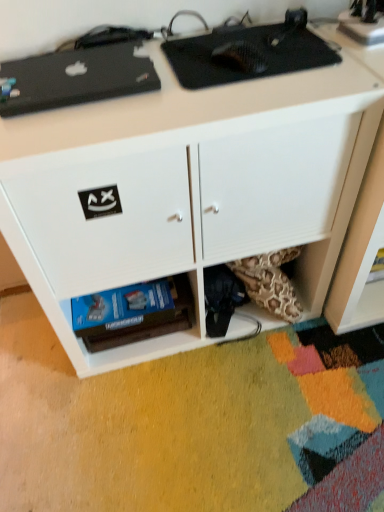
Image resolution: width=384 pixels, height=512 pixels. What do you see at coordinates (248, 53) in the screenshot? I see `black carbon fiber mouse pad at upper center, arranged as the second appliance when viewed from the left` at bounding box center [248, 53].

Describe the element at coordinates (189, 186) in the screenshot. The height and width of the screenshot is (512, 384). I see `white matte desk at upper center` at that location.

Find the location of `metallic silver speaker at upper right, the 3th appliance from the left`. metallic silver speaker at upper right, the 3th appliance from the left is located at coordinates (363, 23).

The height and width of the screenshot is (512, 384). In order to click on black carbon fiber mouse pad at upper center, arranged as the second appliance when viewed from the left in this screenshot , I will do `click(248, 53)`.

From the image's perspective, which is below, white matte desk at upper center or black carbon fiber mouse pad at upper center, arranged as the second appliance when viewed from the left?

white matte desk at upper center.

Would you say white matte desk at upper center is inside or outside black carbon fiber mouse pad at upper center, the second appliance in the right-to-left sequence?

white matte desk at upper center is not enclosed by black carbon fiber mouse pad at upper center, the second appliance in the right-to-left sequence.

Which object is thinner, white matte desk at upper center or black carbon fiber mouse pad at upper center, arranged as the second appliance when viewed from the left?

black carbon fiber mouse pad at upper center, arranged as the second appliance when viewed from the left, is thinner.

Who is taller, white matte desk at upper center or black carbon fiber mouse pad at upper center, arranged as the second appliance when viewed from the left?

white matte desk at upper center.

Which object is thinner, metallic silver speaker at upper right, the 3th appliance from the left, or black carbon fiber mouse pad at upper center, the second appliance in the right-to-left sequence?

Thinner between the two is metallic silver speaker at upper right, the 3th appliance from the left.

From a real-world perspective, relative to black carbon fiber mouse pad at upper center, the second appliance in the right-to-left sequence, is metallic silver speaker at upper right, the 3th appliance from the left, vertically above or below?

From a real-world perspective, metallic silver speaker at upper right, the 3th appliance from the left, is physically above black carbon fiber mouse pad at upper center, the second appliance in the right-to-left sequence.

Is metallic silver speaker at upper right, placed as the first appliance when sorted from right to left, in contact with black carbon fiber mouse pad at upper center, arranged as the second appliance when viewed from the left?

No, metallic silver speaker at upper right, placed as the first appliance when sorted from right to left, is not making contact with black carbon fiber mouse pad at upper center, arranged as the second appliance when viewed from the left.

Is point (366, 16) closer to viewer compared to point (282, 48)?

Yes.

Considering the positions of point (222, 33) and point (78, 58), is point (222, 33) closer or farther from the camera than point (78, 58)?

Point (222, 33).

Considering their positions, is black carbon fiber mouse pad at upper center, arranged as the second appliance when viewed from the left, located in front of or behind black matte laptop at upper left, the third appliance positioned from the right?

Visually, black carbon fiber mouse pad at upper center, arranged as the second appliance when viewed from the left, is located behind black matte laptop at upper left, the third appliance positioned from the right.

Is black carbon fiber mouse pad at upper center, arranged as the second appliance when viewed from the left, aimed at black matte laptop at upper left, the third appliance positioned from the right?

No.

In the image, is black carbon fiber mouse pad at upper center, the second appliance in the right-to-left sequence, on the left side or the right side of black matte laptop at upper left, the third appliance positioned from the right?

From the image, it's evident that black carbon fiber mouse pad at upper center, the second appliance in the right-to-left sequence, is to the right of black matte laptop at upper left, the third appliance positioned from the right.

In the scene shown: From the image's perspective, which one is positioned higher, metallic silver speaker at upper right, the 3th appliance from the left, or white matte desk at upper center?

metallic silver speaker at upper right, the 3th appliance from the left.

Can you confirm if metallic silver speaker at upper right, placed as the first appliance when sorted from right to left, is positioned to the right of white matte desk at upper center?

Yes.

In the scene shown: How much distance is there between metallic silver speaker at upper right, placed as the first appliance when sorted from right to left, and white matte desk at upper center?

metallic silver speaker at upper right, placed as the first appliance when sorted from right to left, and white matte desk at upper center are 19.62 inches apart.

Is white matte desk at upper center completely or partially inside metallic silver speaker at upper right, placed as the first appliance when sorted from right to left?

No, white matte desk at upper center is not a part of metallic silver speaker at upper right, placed as the first appliance when sorted from right to left.

From the picture: Considering the sizes of white matte desk at upper center and metallic silver speaker at upper right, placed as the first appliance when sorted from right to left, in the image, is white matte desk at upper center wider or thinner than metallic silver speaker at upper right, placed as the first appliance when sorted from right to left,?

Clearly, white matte desk at upper center has more width compared to metallic silver speaker at upper right, placed as the first appliance when sorted from right to left.

Is metallic silver speaker at upper right, placed as the first appliance when sorted from right to left, located within white matte desk at upper center?

No, metallic silver speaker at upper right, placed as the first appliance when sorted from right to left, is not a part of white matte desk at upper center.

Is white matte desk at upper center to the left of metallic silver speaker at upper right, placed as the first appliance when sorted from right to left, from the viewer's perspective?

Correct, you'll find white matte desk at upper center to the left of metallic silver speaker at upper right, placed as the first appliance when sorted from right to left.

Is white matte desk at upper center taller than black matte laptop at upper left, positioned as the 1th appliance in left-to-right order?

Yes, white matte desk at upper center is taller than black matte laptop at upper left, positioned as the 1th appliance in left-to-right order.

Considering the sizes of white matte desk at upper center and black matte laptop at upper left, positioned as the 1th appliance in left-to-right order, in the image, is white matte desk at upper center wider or thinner than black matte laptop at upper left, positioned as the 1th appliance in left-to-right order,?

Clearly, white matte desk at upper center has more width compared to black matte laptop at upper left, positioned as the 1th appliance in left-to-right order.

Does white matte desk at upper center have a smaller size compared to black matte laptop at upper left, positioned as the 1th appliance in left-to-right order?

No.

How many degrees apart are the facing directions of white matte desk at upper center and black matte laptop at upper left, the third appliance positioned from the right?

There is a 0.000544-degree angle between the facing directions of white matte desk at upper center and black matte laptop at upper left, the third appliance positioned from the right.

In the scene shown: Would you say black matte laptop at upper left, the third appliance positioned from the right, is part of metallic silver speaker at upper right, placed as the first appliance when sorted from right to left,'s contents?

No, black matte laptop at upper left, the third appliance positioned from the right, is not a part of metallic silver speaker at upper right, placed as the first appliance when sorted from right to left.

Based on the photo, looking at the image, does metallic silver speaker at upper right, the 3th appliance from the left, seem bigger or smaller compared to black matte laptop at upper left, the third appliance positioned from the right?

metallic silver speaker at upper right, the 3th appliance from the left, is smaller than black matte laptop at upper left, the third appliance positioned from the right.

Between metallic silver speaker at upper right, the 3th appliance from the left, and black matte laptop at upper left, the third appliance positioned from the right, which one is positioned in front?

black matte laptop at upper left, the third appliance positioned from the right, is in front.

Based on the photo, considering the sizes of objects metallic silver speaker at upper right, the 3th appliance from the left, and black matte laptop at upper left, positioned as the 1th appliance in left-to-right order, in the image provided, who is thinner, metallic silver speaker at upper right, the 3th appliance from the left, or black matte laptop at upper left, positioned as the 1th appliance in left-to-right order,?

Thinner between the two is metallic silver speaker at upper right, the 3th appliance from the left.

Starting from the white matte desk at upper center, which appliance is the 2nd one behind? Please provide its 2D coordinates.

[(248, 53)]

Image resolution: width=384 pixels, height=512 pixels. In order to click on the 2nd appliance directly above the black carbon fiber mouse pad at upper center, arranged as the second appliance when viewed from the left (from a real-world perspective) in this screenshot , I will do `click(363, 23)`.

Estimate the real-world distances between objects in this image. Which object is closer to white matte desk at upper center, metallic silver speaker at upper right, placed as the first appliance when sorted from right to left, or black matte laptop at upper left, the third appliance positioned from the right?

black matte laptop at upper left, the third appliance positioned from the right.

When comparing their distances from metallic silver speaker at upper right, the 3th appliance from the left, does white matte desk at upper center or black matte laptop at upper left, positioned as the 1th appliance in left-to-right order, seem further?

The object further to metallic silver speaker at upper right, the 3th appliance from the left, is black matte laptop at upper left, positioned as the 1th appliance in left-to-right order.

When comparing their distances from black carbon fiber mouse pad at upper center, arranged as the second appliance when viewed from the left, does white matte desk at upper center or metallic silver speaker at upper right, placed as the first appliance when sorted from right to left, seem closer?

white matte desk at upper center.

Based on the photo, considering their positions, is white matte desk at upper center positioned further to black matte laptop at upper left, the third appliance positioned from the right, than metallic silver speaker at upper right, placed as the first appliance when sorted from right to left?

Based on the image, metallic silver speaker at upper right, placed as the first appliance when sorted from right to left, appears to be further to black matte laptop at upper left, the third appliance positioned from the right.

Which object lies further to the anchor point white matte desk at upper center, black carbon fiber mouse pad at upper center, arranged as the second appliance when viewed from the left, or metallic silver speaker at upper right, the 3th appliance from the left?

Based on the image, metallic silver speaker at upper right, the 3th appliance from the left, appears to be further to white matte desk at upper center.

Estimate the real-world distances between objects in this image. Which object is closer to black matte laptop at upper left, positioned as the 1th appliance in left-to-right order, black carbon fiber mouse pad at upper center, arranged as the second appliance when viewed from the left, or metallic silver speaker at upper right, placed as the first appliance when sorted from right to left?

Among the two, black carbon fiber mouse pad at upper center, arranged as the second appliance when viewed from the left, is located nearer to black matte laptop at upper left, positioned as the 1th appliance in left-to-right order.

Looking at the image, which one is located further to metallic silver speaker at upper right, placed as the first appliance when sorted from right to left, black carbon fiber mouse pad at upper center, arranged as the second appliance when viewed from the left, or white matte desk at upper center?

white matte desk at upper center lies further to metallic silver speaker at upper right, placed as the first appliance when sorted from right to left, than the other object.

Looking at the image, which one is located further to black matte laptop at upper left, positioned as the 1th appliance in left-to-right order, black carbon fiber mouse pad at upper center, the second appliance in the right-to-left sequence, or white matte desk at upper center?

Among the two, white matte desk at upper center is located further to black matte laptop at upper left, positioned as the 1th appliance in left-to-right order.

At what (x,y) coordinates should I click in order to perform the action: click on desk between black matte laptop at upper left, the third appliance positioned from the right, and black carbon fiber mouse pad at upper center, the second appliance in the right-to-left sequence. Please return your answer as a coordinate pair (x, y). Looking at the image, I should click on (189, 186).

The width and height of the screenshot is (384, 512). I want to click on appliance between white matte desk at upper center and metallic silver speaker at upper right, the 3th appliance from the left, from left to right, so click(x=248, y=53).

Where is `appliance between black matte laptop at upper left, the third appliance positioned from the right, and metallic silver speaker at upper right, the 3th appliance from the left, from left to right`? This screenshot has height=512, width=384. appliance between black matte laptop at upper left, the third appliance positioned from the right, and metallic silver speaker at upper right, the 3th appliance from the left, from left to right is located at coordinates (248, 53).

Where is `desk situated between black matte laptop at upper left, positioned as the 1th appliance in left-to-right order, and metallic silver speaker at upper right, the 3th appliance from the left, from left to right`? The height and width of the screenshot is (512, 384). desk situated between black matte laptop at upper left, positioned as the 1th appliance in left-to-right order, and metallic silver speaker at upper right, the 3th appliance from the left, from left to right is located at coordinates pyautogui.click(x=189, y=186).